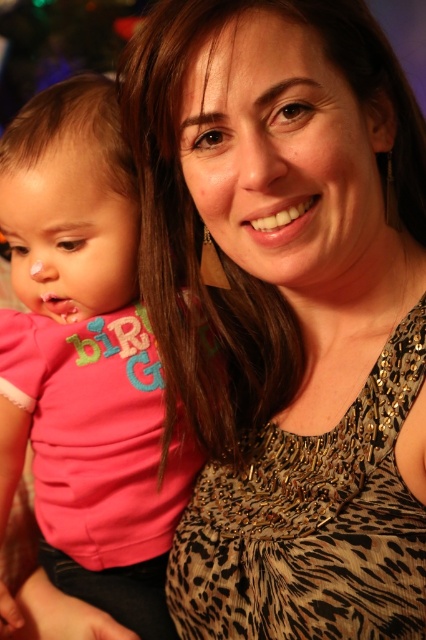
You are a photographer setting up for a family photo shoot. You need to ensure that the leopard print tank top at center and the pink fabric shirt at left are both visible in the frame. Given their sizes, which item might require more space horizontally to avoid being cut off?

The leopard print tank top at center requires more horizontal space because its width is larger than the pink fabric shirt at left.

You are a photographer trying to capture a closeup shot of both the leopard print tank top at center and the pink fabric shirt at left. Given that your camera lens can focus on objects within a 5 inch range, will you be able to capture both items clearly in the same photo?

The leopard print tank top at center and pink fabric shirt at left are 6.09 inches apart, which exceeds the 5 inch focus range of the camera lens. Therefore, you cannot capture both items clearly in the same photo.